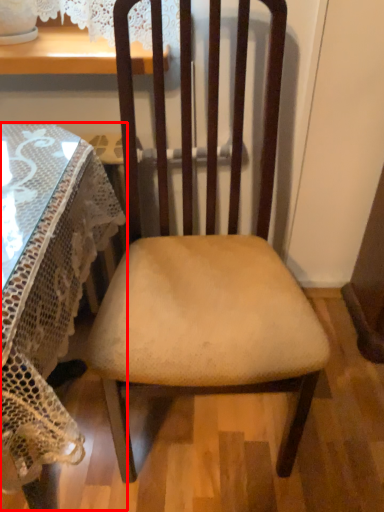
Question: Where is table (annotated by the red box) located in relation to chair in the image?

Choices:
 (A) right
 (B) left

Answer: (B)